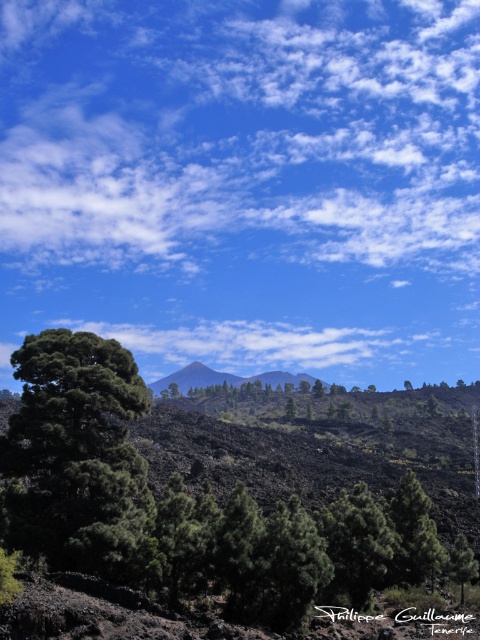
Question: Can you confirm if white fluffy cloud at upper center is thinner than matte black mountain at center?

Choices:
 (A) yes
 (B) no

Answer: (B)

Question: Considering the real-world distances, which object is closest to the matte black mountain at center?

Choices:
 (A) white fluffy cloud at upper center
 (B) dark green leafy tree at lower left

Answer: (A)

Question: Which of these objects is positioned farthest from the white fluffy cloud at upper center?

Choices:
 (A) dark green leafy tree at lower left
 (B) matte black mountain at center

Answer: (A)

Question: Does white fluffy cloud at upper center have a smaller size compared to matte black mountain at center?

Choices:
 (A) no
 (B) yes

Answer: (A)

Question: Which object is positioned closest to the dark green leafy tree at lower left?

Choices:
 (A) white fluffy cloud at upper center
 (B) matte black mountain at center

Answer: (A)

Question: Is white fluffy cloud at upper center smaller than dark green leafy tree at lower left?

Choices:
 (A) yes
 (B) no

Answer: (B)